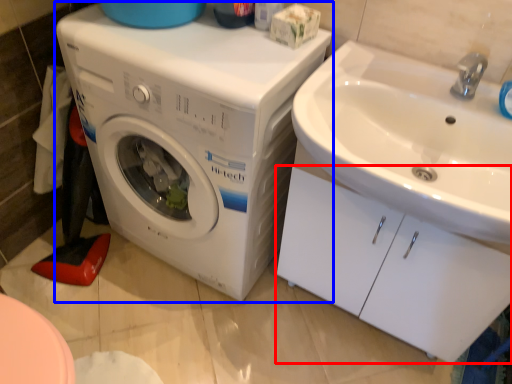
Question: Which of the following is the closest to the observer, drawer (highlighted by a red box) or washing machine (highlighted by a blue box)?

Choices:
 (A) drawer
 (B) washing machine

Answer: (A)